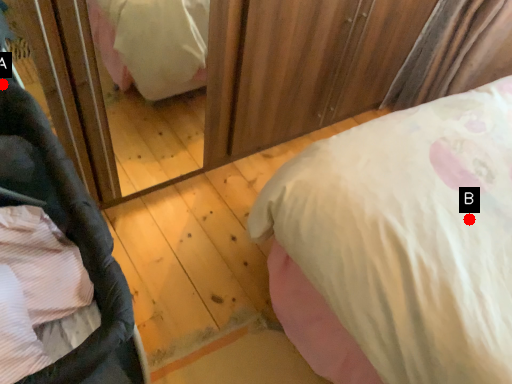
Question: Two points are circled on the image, labeled by A and B beside each circle. Which of the following is the farthest from the observer?

Choices:
 (A) A is further
 (B) B is further

Answer: (B)